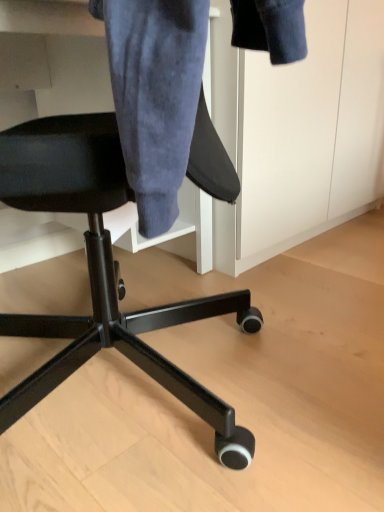
This screenshot has width=384, height=512. Identify the location of vacant space underneath black fabric chair at center (from a real-world perspective). (133, 393).